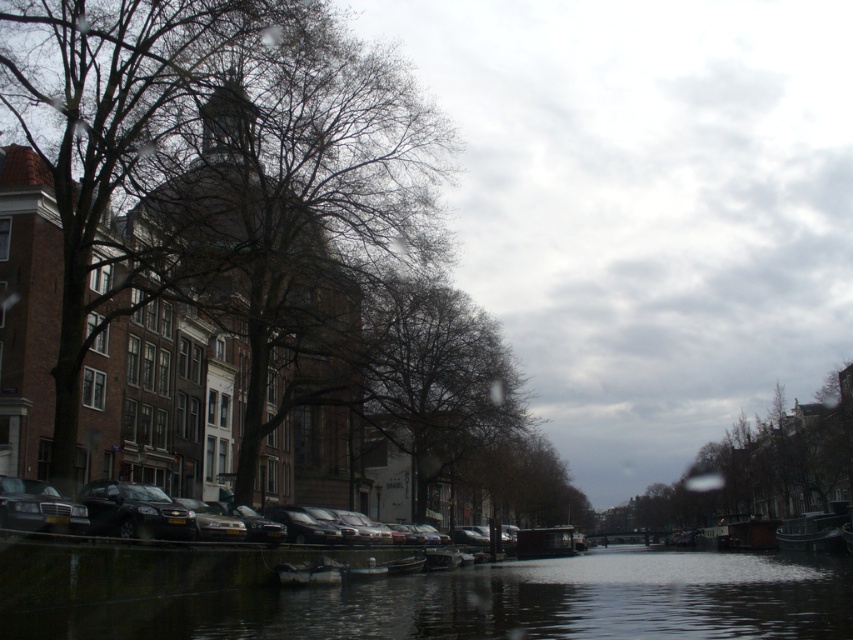
Is dark reflective water at center closer to the viewer compared to shiny black car at lower center?

Yes, it is in front of shiny black car at lower center.

At what (x,y) coordinates should I click in order to perform the action: click on dark reflective water at center. Please return your answer as a coordinate pair (x, y). Looking at the image, I should click on (503, 602).

Identify the location of dark reflective water at center. The width and height of the screenshot is (853, 640). (503, 602).

Can you confirm if brown textured building at left is taller than matte black car at lower left?

Yes, brown textured building at left is taller than matte black car at lower left.

Is brown textured building at left bigger than matte black car at lower left?

Yes.

Between point (103, 106) and point (80, 520), which one is positioned in front?

Point (80, 520) is in front.

The height and width of the screenshot is (640, 853). I want to click on brown textured building at left, so 115,141.

Does green leafy tree at center appear on the left side of metallic silver boat at lower right?

Incorrect, green leafy tree at center is not on the left side of metallic silver boat at lower right.

Is green leafy tree at center behind metallic silver boat at lower right?

Yes, green leafy tree at center is further from the viewer.

At what (x,y) coordinates should I click in order to perform the action: click on green leafy tree at center. Please return your answer as a coordinate pair (x, y). The height and width of the screenshot is (640, 853). Looking at the image, I should click on (757, 470).